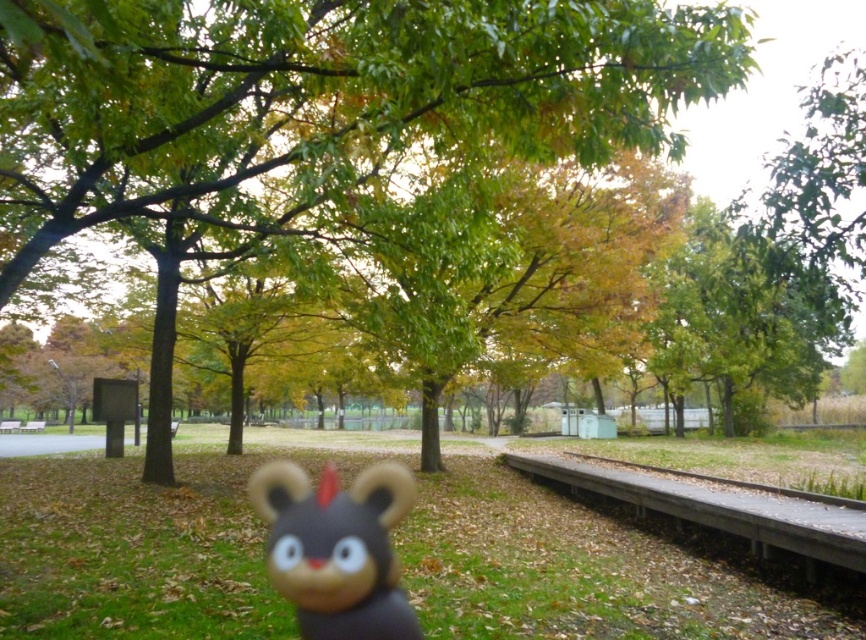
Question: Can you confirm if green leafy tree at center is positioned below wooden park bench at center?

Choices:
 (A) no
 (B) yes

Answer: (A)

Question: Is fuzzy brown plush toy at center to the left of brown wooden bench at center from the viewer's perspective?

Choices:
 (A) no
 (B) yes

Answer: (A)

Question: Among these points, which one is farthest from the camera?

Choices:
 (A) (20, 426)
 (B) (729, 68)
 (C) (40, 420)

Answer: (C)

Question: Which of the following is the closest to the observer?

Choices:
 (A) (211, 145)
 (B) (18, 426)
 (C) (42, 424)

Answer: (A)

Question: Estimate the real-world distances between objects in this image. Which object is closer to the brown wooden bench at center?

Choices:
 (A) wooden park bench at center
 (B) green leafy tree at center

Answer: (A)

Question: Can you confirm if fuzzy brown plush toy at center is wider than brown wooden bench at center?

Choices:
 (A) yes
 (B) no

Answer: (A)